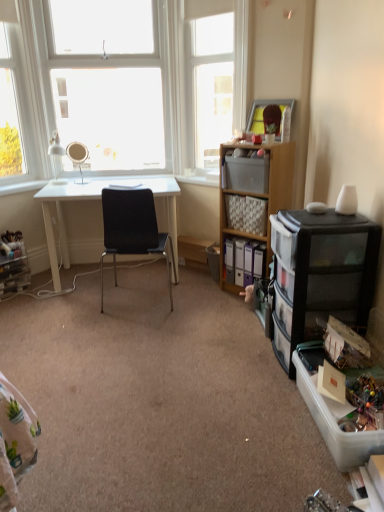
I want to click on vacant space in white glossy desk at center (from a real-world perspective), so click(x=127, y=273).